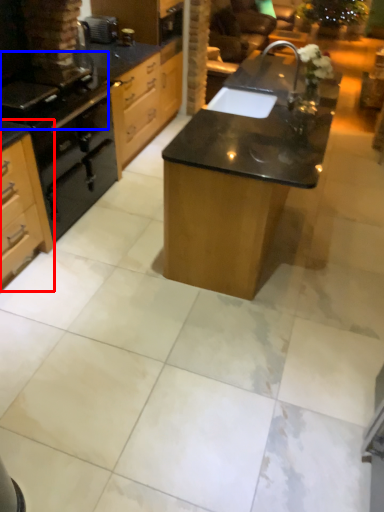
Question: Which point is further to the camera, cabinetry (highlighted by a red box) or gas stove (highlighted by a blue box)?

Choices:
 (A) cabinetry
 (B) gas stove

Answer: (B)